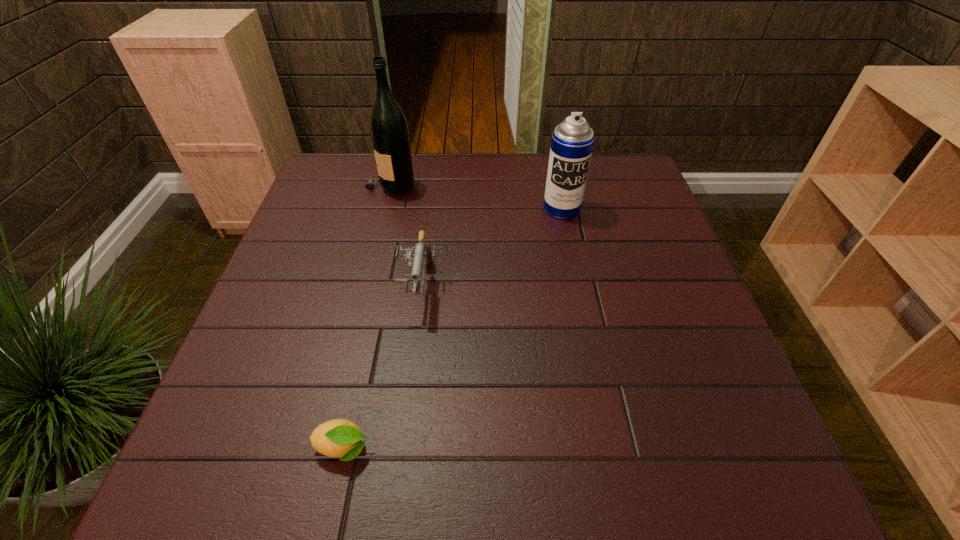
I want to click on the farthest object, so click(x=389, y=131).

Locate an element on the screen. wine bottle is located at coordinates (389, 131).

Locate an element on the screen. This screenshot has height=540, width=960. the third shortest object is located at coordinates (572, 141).

The height and width of the screenshot is (540, 960). Find the location of `the third nearest object`. the third nearest object is located at coordinates (572, 141).

Locate an element on the screen. The width and height of the screenshot is (960, 540). gun is located at coordinates (422, 254).

Where is `the third tallest object`? This screenshot has height=540, width=960. the third tallest object is located at coordinates (422, 254).

Identify the location of lemon. (341, 438).

Where is `the shortest object`? This screenshot has height=540, width=960. the shortest object is located at coordinates (341, 438).

Find the location of a particular element. This screenshot has width=960, height=540. vacant position located 0.360m on the front of the wine bottle is located at coordinates (365, 291).

The height and width of the screenshot is (540, 960). I want to click on free space located 0.340m on the label side of the third nearest object, so click(x=585, y=319).